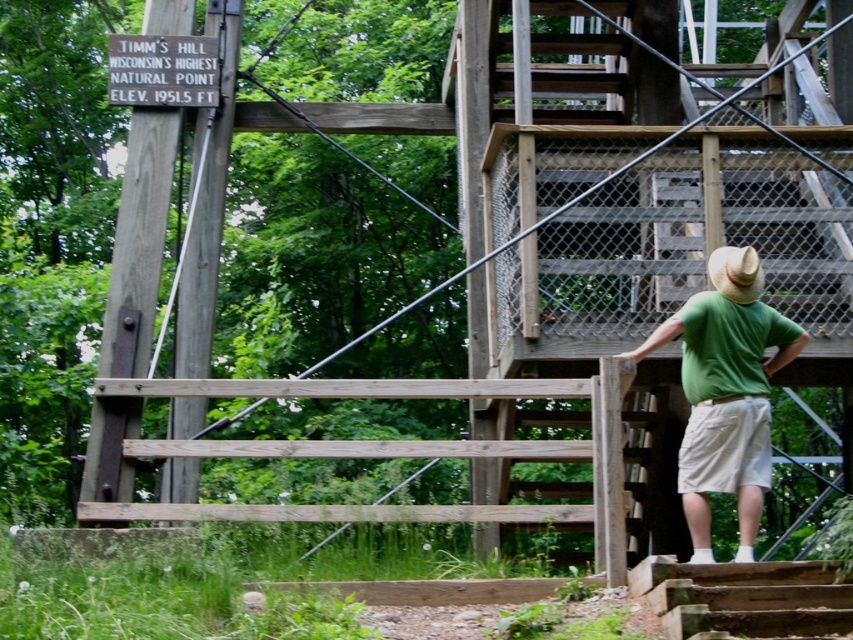
Which of these two, green matte shirt at right or wooden stairs at lower right, stands shorter?

green matte shirt at right is shorter.

Can you confirm if green matte shirt at right is positioned to the right of wooden stairs at lower right?

Indeed, green matte shirt at right is positioned on the right side of wooden stairs at lower right.

Identify the location of green matte shirt at right. The height and width of the screenshot is (640, 853). (726, 392).

At what (x,y) coordinates should I click in order to perform the action: click on green matte shirt at right. Please return your answer as a coordinate pair (x, y). The width and height of the screenshot is (853, 640). Looking at the image, I should click on (726, 392).